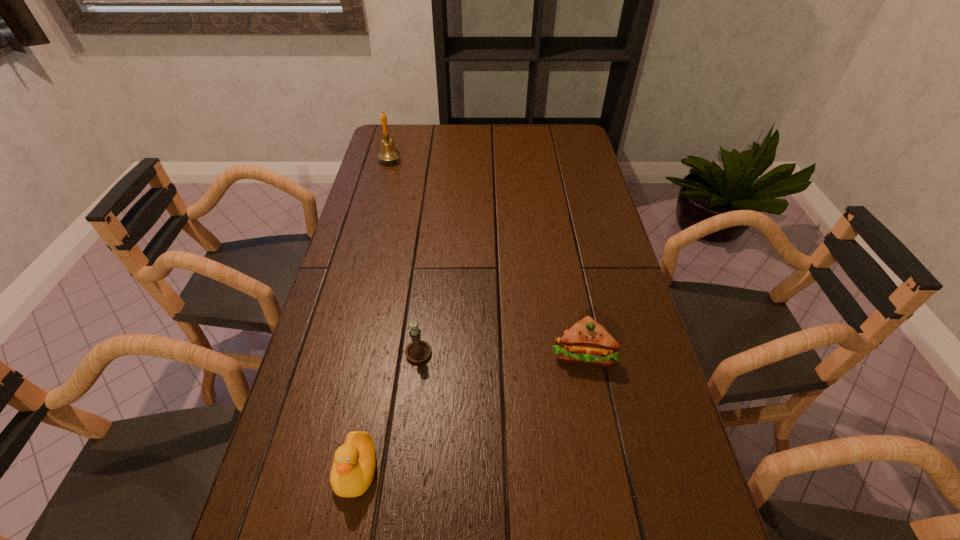
This screenshot has width=960, height=540. I want to click on empty space that is in between the candle holder and the rightmost object, so click(x=501, y=352).

You are a GUI agent. You are given a task and a screenshot of the screen. Output one action in this format:
    pyautogui.click(x=<x>, y=<y>)
    Task: Click on the free area in between the rightmost object and the third object from right to left
    The image size is (960, 540).
    Given the screenshot: What is the action you would take?
    pyautogui.click(x=469, y=411)

Find the location of `free spot between the nearest object and the rightmost object`. free spot between the nearest object and the rightmost object is located at coordinates (469, 411).

At what (x,y) coordinates should I click in order to perform the action: click on vacant space that is in between the rightmost object and the third object from left to right. Please return your answer as a coordinate pair (x, y). Image resolution: width=960 pixels, height=540 pixels. Looking at the image, I should click on (501, 352).

In order to click on free spot between the bell and the rightmost object in this screenshot , I will do `click(487, 256)`.

Find the location of a particular element. Image resolution: width=960 pixels, height=540 pixels. empty space between the sandwich and the second object from left to right is located at coordinates (469, 411).

In order to click on vacant region between the nearest object and the candle holder in this screenshot , I will do `click(388, 410)`.

Where is `empty location between the candle holder and the leftmost object`? empty location between the candle holder and the leftmost object is located at coordinates (404, 255).

Where is `free area in between the tallest object and the third object from right to left`? The width and height of the screenshot is (960, 540). free area in between the tallest object and the third object from right to left is located at coordinates (373, 315).

Locate an element on the screen. free space between the rightmost object and the bell is located at coordinates (487, 256).